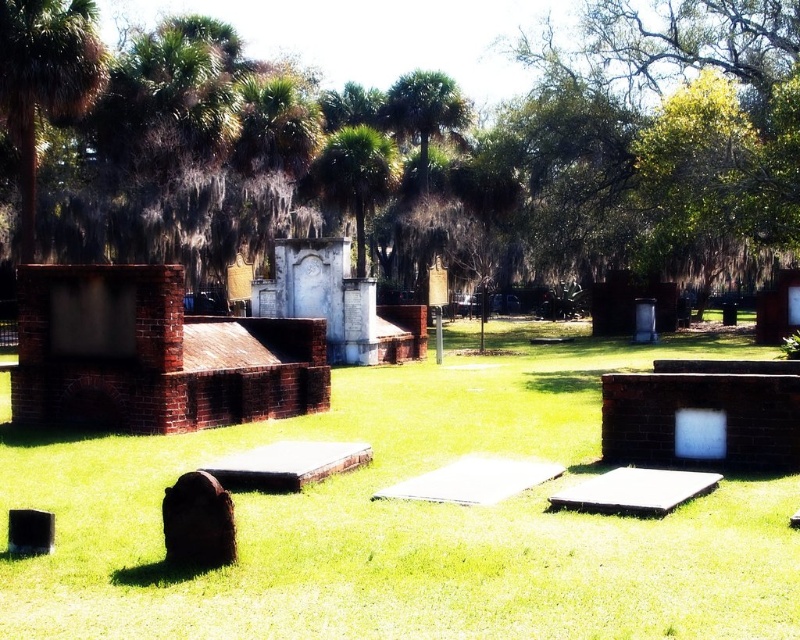
Is point (362, 214) closer to viewer compared to point (224, 548)?

No.

Who is more distant from viewer, (370, 168) or (208, 490)?

Point (370, 168)

The width and height of the screenshot is (800, 640). What do you see at coordinates (354, 177) in the screenshot?
I see `green leafy palm tree at center` at bounding box center [354, 177].

Identify the location of green leafy palm tree at center. Image resolution: width=800 pixels, height=640 pixels. (354, 177).

Does green grass at center have a greater height compared to dark brown stone gravestone at lower left?

Correct, green grass at center is much taller as dark brown stone gravestone at lower left.

I want to click on green grass at center, so click(x=406, y=518).

The image size is (800, 640). What are the coordinates of `green grass at center` in the screenshot? It's located at (406, 518).

Which of these two, green leafy tree at upper center or green grass at center, stands shorter?

With less height is green grass at center.

Which is below, green leafy tree at upper center or green grass at center?

Positioned lower is green grass at center.

Does point (216, 20) come closer to viewer compared to point (533, 518)?

That is False.

The width and height of the screenshot is (800, 640). In order to click on green leafy tree at upper center in this screenshot , I will do `click(418, 147)`.